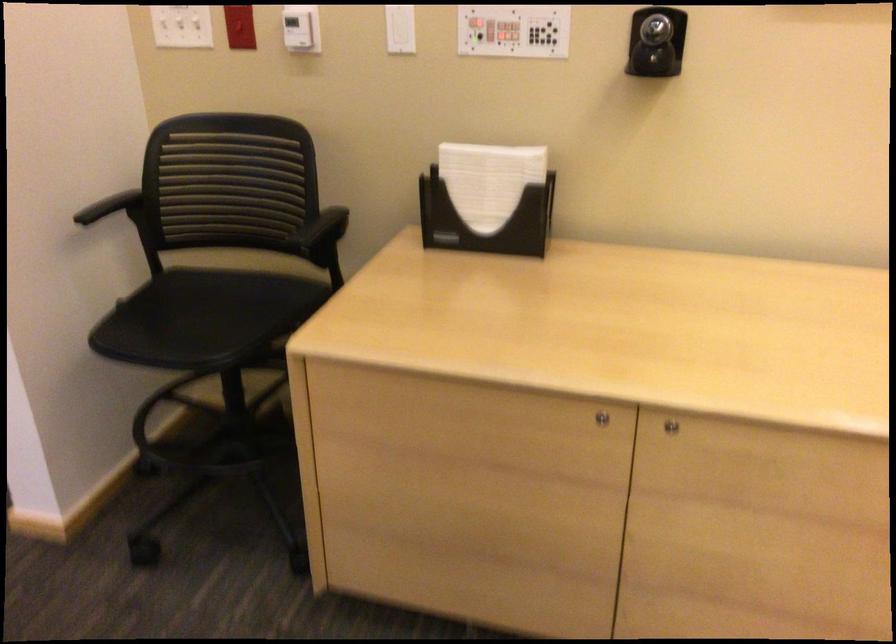
This screenshot has width=896, height=644. Describe the element at coordinates (108, 207) in the screenshot. I see `the chair armrest` at that location.